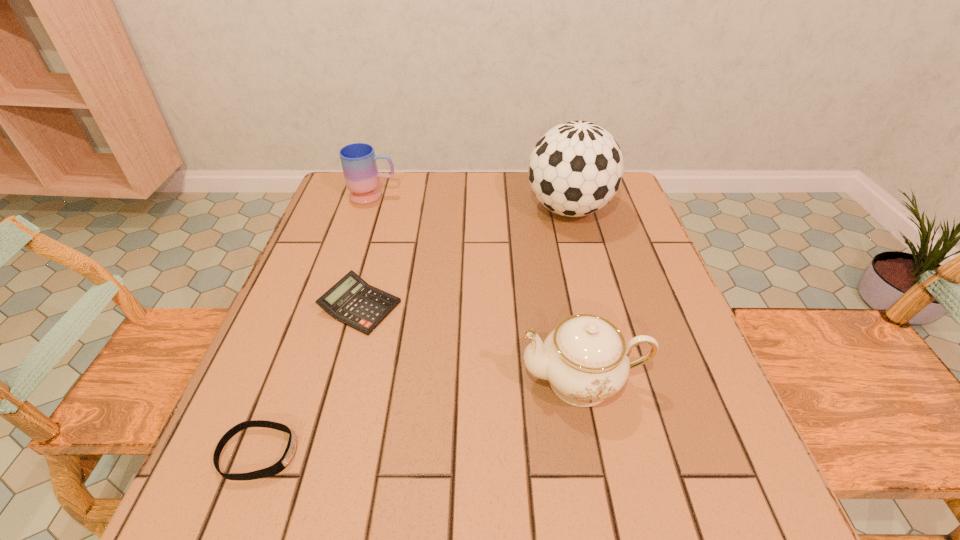
Locate an element on the screen. free space that is in between the calculator and the tallest object is located at coordinates (465, 258).

Identify the location of free space between the fourth tallest object and the wristband. (309, 380).

Identify the location of free space between the tallest object and the nearest object. pos(414,331).

In order to click on free space between the nearest object and the mug in this screenshot , I will do click(316, 325).

In order to click on free space between the third farthest object and the shortest object in this screenshot , I will do `click(309, 380)`.

Identify the location of free space between the second nearest object and the second shortest object. (471, 343).

This screenshot has height=540, width=960. What are the coordinates of `vacant space that's between the second shortest object and the mug` in the screenshot? It's located at (367, 251).

At what (x,y) coordinates should I click in order to perform the action: click on vacant space that's between the tallest object and the mug. Please return your answer as a coordinate pair (x, y). Looking at the image, I should click on (471, 202).

Where is `unoccupied area between the mug and the chinaware`? unoccupied area between the mug and the chinaware is located at coordinates (478, 288).

Where is `object that ranks as the closest to the shortest object`? object that ranks as the closest to the shortest object is located at coordinates (352, 301).